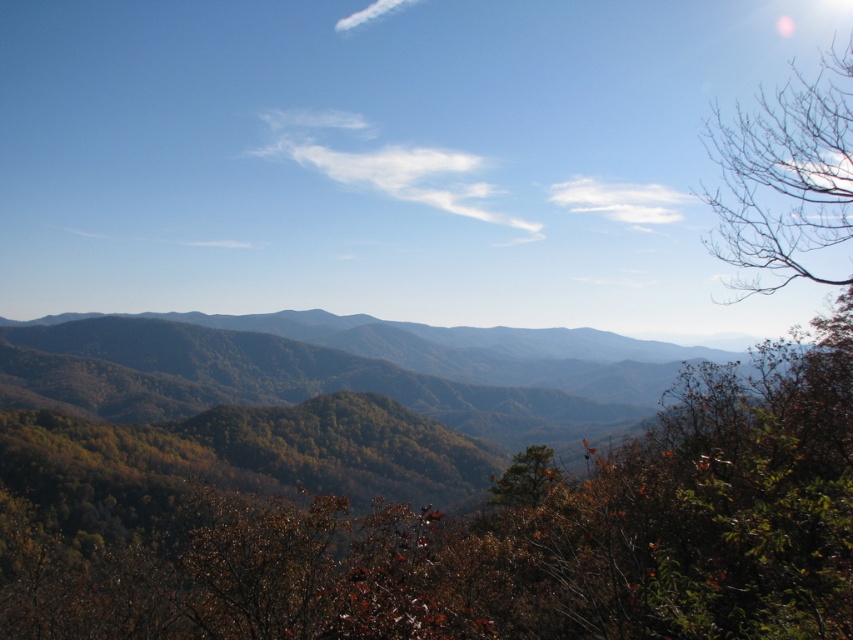
You are an artist sketching the mountainous landscape. You notice the bare branches at upper right and the green matte tree at center. Which object would you need to draw first if you are following the standard perspective technique that starts with the closest elements?

The green matte tree at center should be drawn first because the bare branches at upper right is taller than it, suggesting it is further away and part of the background, while the green matte tree at center is closer and part of the midground or foreground.

You are an ornithologist observing the mountain landscape. You notice a green leafy tree at center and a bare branches at upper right. Which of these two objects is positioned higher in the image?

The bare branches at upper right are positioned higher in the image than the green leafy tree at center.